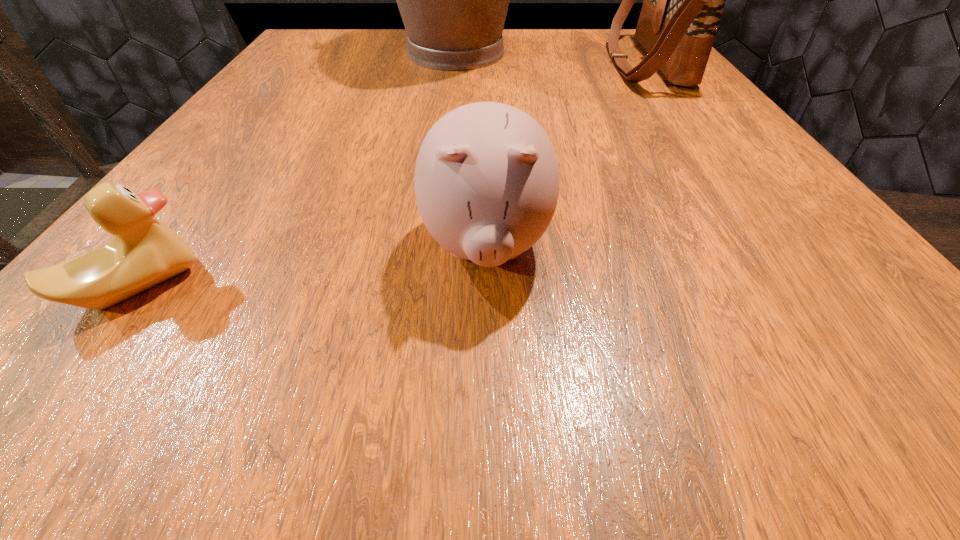
At what (x,y) coordinates should I click in order to perform the action: click on free space located at the snout of the third tallest object. Please return your answer as a coordinate pair (x, y). This screenshot has height=540, width=960. Looking at the image, I should click on 488,361.

What are the coordinates of `vacant space located at the beak of the leftmost object` in the screenshot? It's located at (437, 286).

Locate an element on the screen. bucket that is at the far edge is located at coordinates (453, 0).

Identify the location of shoulder bag that is at the far edge. (683, 3).

Locate an element on the screen. The width and height of the screenshot is (960, 540). object that is at the near edge is located at coordinates (144, 252).

At what (x,y) coordinates should I click in order to perform the action: click on object that is at the left edge. Please return your answer as a coordinate pair (x, y). Looking at the image, I should click on (144, 252).

You are a GUI agent. You are given a task and a screenshot of the screen. Output one action in this format:
    pyautogui.click(x=<x>, y=<y>)
    Task: Click on the object that is at the right edge
    The height and width of the screenshot is (540, 960).
    Given the screenshot: What is the action you would take?
    pyautogui.click(x=683, y=3)

Find the location of a particular element. The width and height of the screenshot is (960, 540). object situated at the near left corner is located at coordinates (144, 252).

Image resolution: width=960 pixels, height=540 pixels. I want to click on object present at the far right corner, so click(683, 3).

In the image, there is a desktop. At what (x,y) coordinates should I click in order to perform the action: click on vacant space at the far edge. Please return your answer as a coordinate pair (x, y). Image resolution: width=960 pixels, height=540 pixels. Looking at the image, I should click on (391, 37).